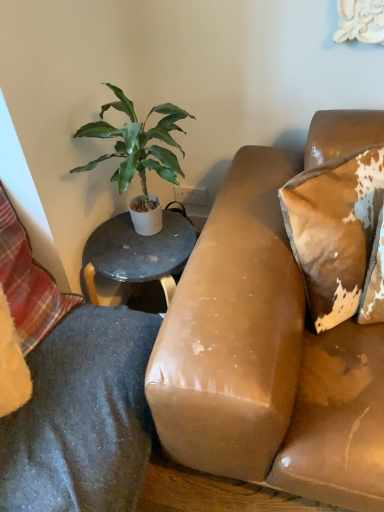
Question: Is brown distressed leather pillow at upper right, placed as the 2th pillow when sorted from left to right, at the left side of plaid fabric pillow at lower left, the 1th pillow viewed from the left?

Choices:
 (A) no
 (B) yes

Answer: (A)

Question: Is brown distressed leather pillow at upper right, positioned as the first pillow in right-to-left order, located outside plaid fabric pillow at lower left, placed as the second pillow when sorted from right to left?

Choices:
 (A) no
 (B) yes

Answer: (B)

Question: Is brown distressed leather pillow at upper right, placed as the 2th pillow when sorted from left to right, further to camera compared to plaid fabric pillow at lower left, placed as the second pillow when sorted from right to left?

Choices:
 (A) no
 (B) yes

Answer: (B)

Question: Considering the relative sizes of brown distressed leather pillow at upper right, placed as the 2th pillow when sorted from left to right, and plaid fabric pillow at lower left, placed as the second pillow when sorted from right to left, in the image provided, is brown distressed leather pillow at upper right, placed as the 2th pillow when sorted from left to right, thinner than plaid fabric pillow at lower left, placed as the second pillow when sorted from right to left,?

Choices:
 (A) no
 (B) yes

Answer: (B)

Question: From a real-world perspective, is brown distressed leather pillow at upper right, placed as the 2th pillow when sorted from left to right, physically above plaid fabric pillow at lower left, the 1th pillow viewed from the left?

Choices:
 (A) yes
 (B) no

Answer: (A)

Question: Is plaid fabric pillow at lower left, placed as the second pillow when sorted from right to left, in front of or behind brown distressed leather pillow at upper right, placed as the 2th pillow when sorted from left to right, in the image?

Choices:
 (A) front
 (B) behind

Answer: (A)

Question: Do you think plaid fabric pillow at lower left, the 1th pillow viewed from the left, is within brown distressed leather pillow at upper right, positioned as the first pillow in right-to-left order, or outside of it?

Choices:
 (A) inside
 (B) outside

Answer: (B)

Question: From the image's perspective, is plaid fabric pillow at lower left, the 1th pillow viewed from the left, located above or below brown distressed leather pillow at upper right, positioned as the first pillow in right-to-left order?

Choices:
 (A) below
 (B) above

Answer: (A)

Question: Is plaid fabric pillow at lower left, the 1th pillow viewed from the left, to the left or to the right of brown distressed leather pillow at upper right, positioned as the first pillow in right-to-left order, in the image?

Choices:
 (A) left
 (B) right

Answer: (A)

Question: In the image, is green leafy plant at upper left on the left side or the right side of brown distressed leather pillow at upper right, positioned as the first pillow in right-to-left order?

Choices:
 (A) right
 (B) left

Answer: (B)

Question: In the image, is green leafy plant at upper left positioned in front of or behind brown distressed leather pillow at upper right, placed as the 2th pillow when sorted from left to right?

Choices:
 (A) front
 (B) behind

Answer: (B)

Question: Is point (145, 143) positioned closer to the camera than point (324, 196)?

Choices:
 (A) closer
 (B) farther

Answer: (B)

Question: Considering the positions of green leafy plant at upper left and brown distressed leather pillow at upper right, placed as the 2th pillow when sorted from left to right, in the image, is green leafy plant at upper left taller or shorter than brown distressed leather pillow at upper right, placed as the 2th pillow when sorted from left to right,?

Choices:
 (A) tall
 (B) short

Answer: (A)

Question: Looking at their shapes, would you say green leafy plant at upper left is wider or thinner than plaid fabric pillow at lower left, placed as the second pillow when sorted from right to left?

Choices:
 (A) wide
 (B) thin

Answer: (A)

Question: Does point (77, 131) appear closer or farther from the camera than point (3, 196)?

Choices:
 (A) closer
 (B) farther

Answer: (B)